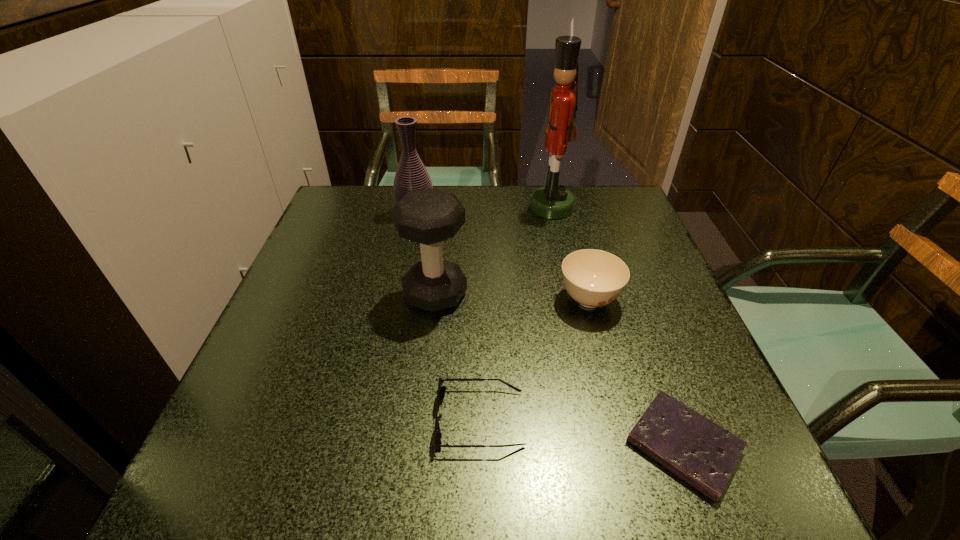
At what (x,y) coordinates should I click in order to perform the action: click on nutcracker present at the right edge. Please return your answer as a coordinate pair (x, y). Looking at the image, I should click on 553,201.

At what (x,y) coordinates should I click in order to perform the action: click on sugar bowl located in the right edge section of the desktop. Please return your answer as a coordinate pair (x, y). Looking at the image, I should click on (594, 278).

At what (x,y) coordinates should I click in order to perform the action: click on diary that is at the right edge. Please return your answer as a coordinate pair (x, y). Looking at the image, I should click on (703, 454).

The image size is (960, 540). Identify the location of object present at the far right corner. (553, 201).

Identify the location of object located at the near right corner. The width and height of the screenshot is (960, 540). (703, 454).

This screenshot has width=960, height=540. In the image, there is a desktop. What are the coordinates of `free region at the far edge` in the screenshot? It's located at (571, 214).

Identify the location of blank area at the near edge. The height and width of the screenshot is (540, 960). (413, 449).

I want to click on blank area at the left edge, so click(x=300, y=287).

Where is `free region at the right edge`? free region at the right edge is located at coordinates (660, 325).

Locate an element on the screen. vacant space at the far left corner is located at coordinates (341, 201).